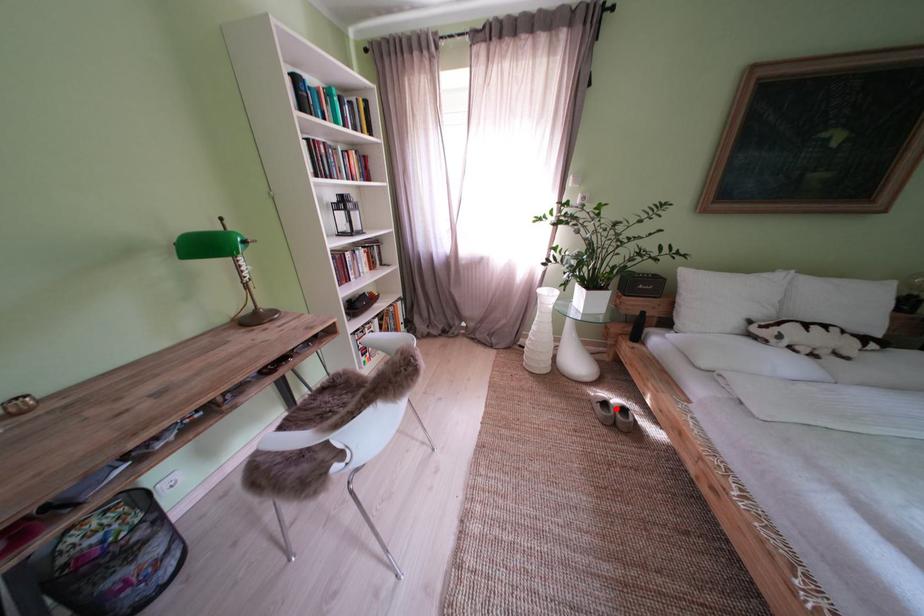
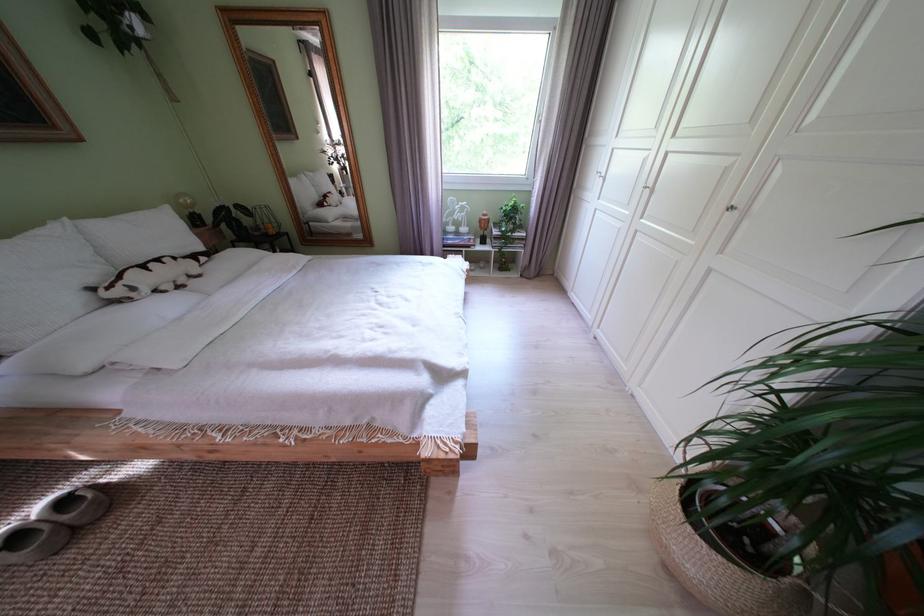
Question: A red point is marked in image1. In image2, is the corresponding 3D point closer to the camera or farther? Reply with the corresponding letter.

Choices:
 (A) The corresponding 3D point is closer.
 (B) The corresponding 3D point is farther.

Answer: (B)